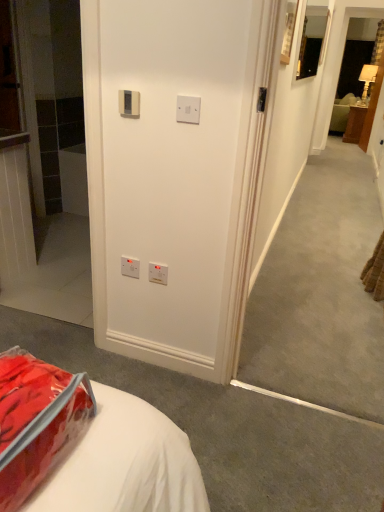
Question: Considering the relative positions of white plastic electric outlet at center, positioned as the third electric outlet in front-to-back order, and matte black mirror at upper right in the image provided, is white plastic electric outlet at center, positioned as the third electric outlet in front-to-back order, to the left or to the right of matte black mirror at upper right?

Choices:
 (A) right
 (B) left

Answer: (B)

Question: From the image's perspective, is white plastic electric outlet at center, which is counted as the third electric outlet, starting from the left, positioned above or below matte black mirror at upper right?

Choices:
 (A) below
 (B) above

Answer: (A)

Question: Which object is the closest to the beige plastic thermostat at upper center, the 4th electric outlet from the bottom?

Choices:
 (A) white plastic electric outlet at center, arranged as the fourth electric outlet when viewed from the top
 (B) matte black mirror at upper right
 (C) translucent plastic bag at lower left
 (D) white plastic switch at upper center, which is counted as the third electric outlet, starting from the bottom
 (E) white plastic electric outlet at lower center, marked as the 2th electric outlet in a bottom-to-top arrangement

Answer: (D)

Question: Which object is positioned farthest from the white plastic electric outlet at center, which is the 1th electric outlet from bottom to top?

Choices:
 (A) white plastic electric outlet at lower center, acting as the 1th electric outlet starting from the left
 (B) beige plastic thermostat at upper center, positioned as the 2th electric outlet in left-to-right order
 (C) translucent plastic bag at lower left
 (D) wooden nightstand at right
 (E) matte black mirror at upper right

Answer: (D)